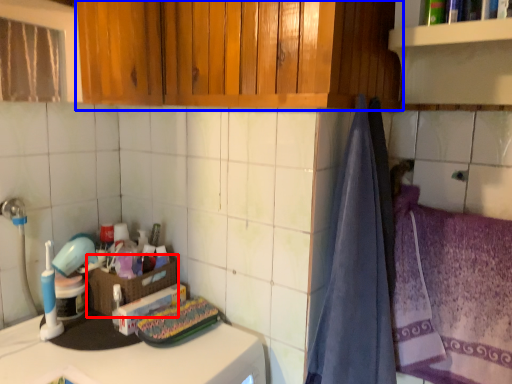
Question: Which of the following is the closest to the observer, basket (highlighted by a red box) or cabinetry (highlighted by a blue box)?

Choices:
 (A) basket
 (B) cabinetry

Answer: (B)